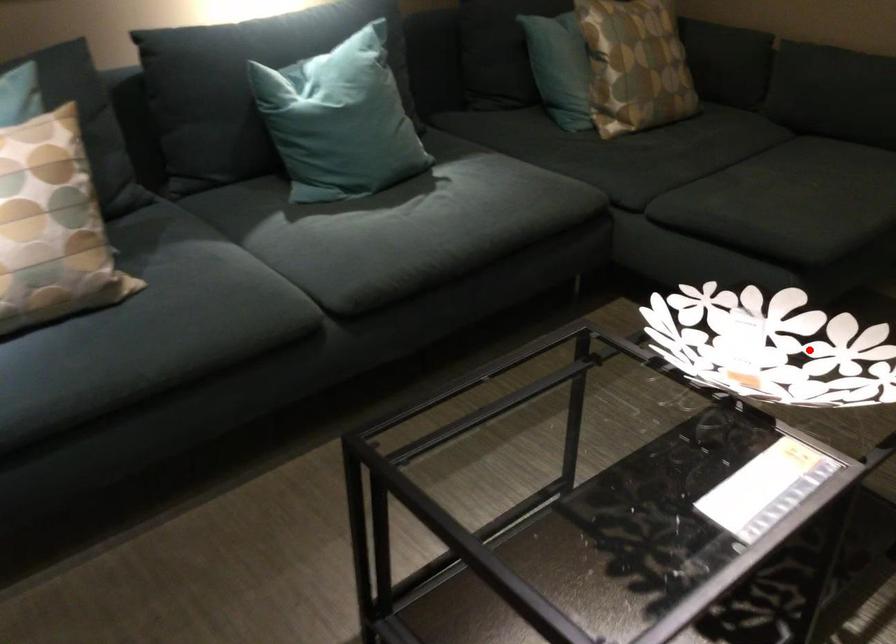
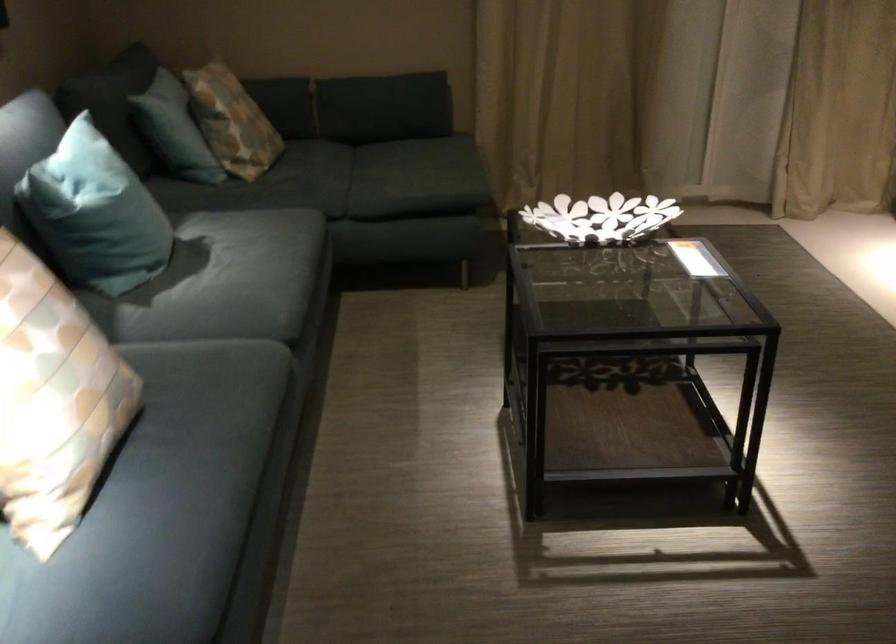
Find the pixel in the second image that matches the highlighted location in the first image.

(600, 218)